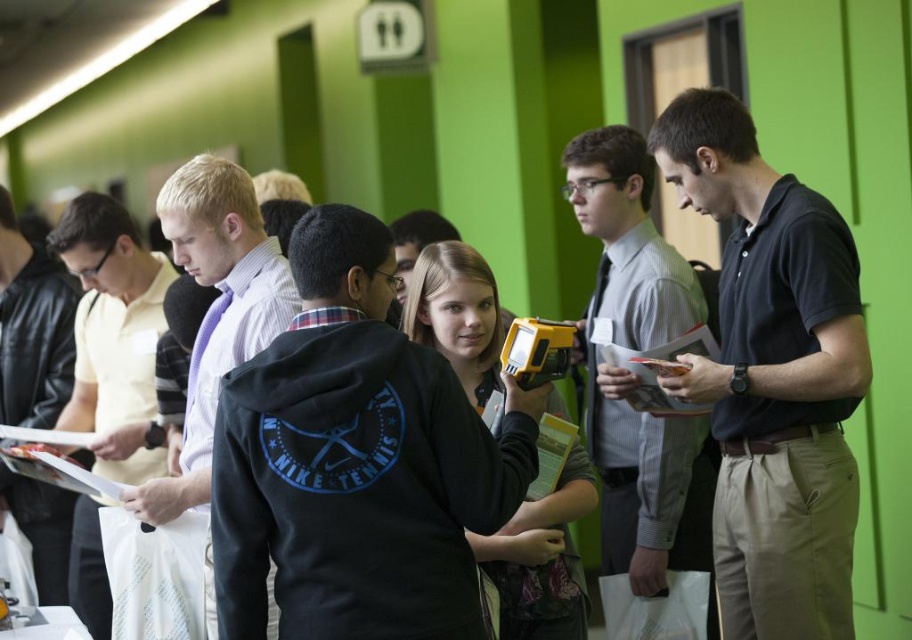
Does black smooth polo shirt at center have a lesser width compared to matte black hoodie at center?

Yes.

Which is in front, point (754, 538) or point (536, 595)?

Point (754, 538)

Where is `black smooth polo shirt at center`? black smooth polo shirt at center is located at coordinates (772, 376).

Is point (102, 250) closer to viewer compared to point (640, 403)?

No, (102, 250) is behind (640, 403).

Can you confirm if light purple shirt at left is smaller than matte gray book at center?

No.

Between point (74, 268) and point (649, 406), which one is positioned behind?

The point (74, 268) is behind.

Identify the location of light purple shirt at left. click(x=114, y=336).

Does point (591, 424) lie in front of point (163, 433)?

Yes, point (591, 424) is closer to viewer.

Does point (712, 323) come farther from viewer compared to point (125, 326)?

No, (712, 323) is closer to viewer.

In order to click on dark blue shirt at center in this screenshot , I will do `click(633, 376)`.